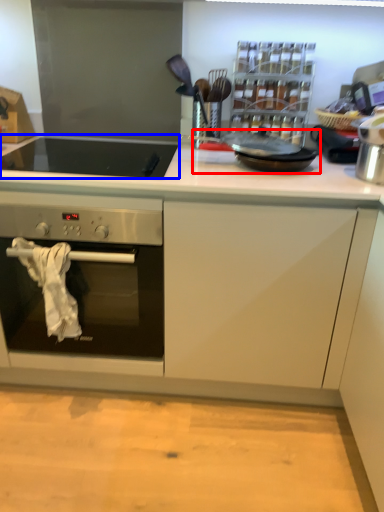
Question: Which point is further to the camera, frying pan (highlighted by a red box) or gas stove (highlighted by a blue box)?

Choices:
 (A) frying pan
 (B) gas stove

Answer: (A)